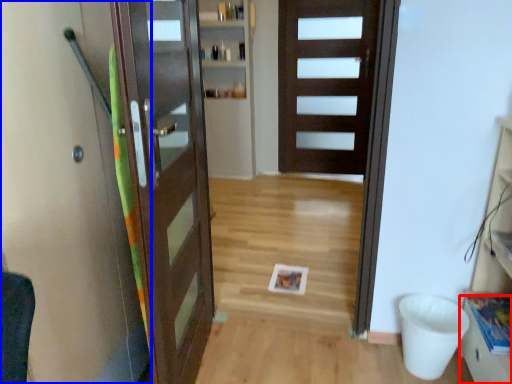
Question: Which object is further to the camera taking this photo, drawer (highlighted by a red box) or elevator (highlighted by a blue box)?

Choices:
 (A) drawer
 (B) elevator

Answer: (A)